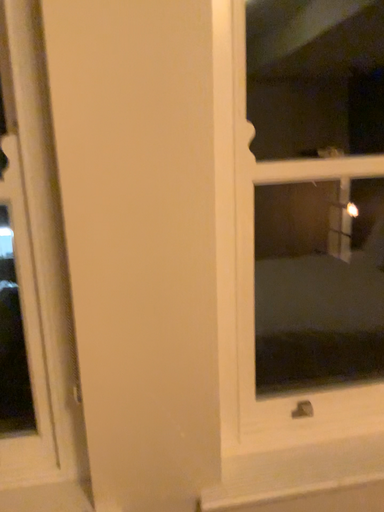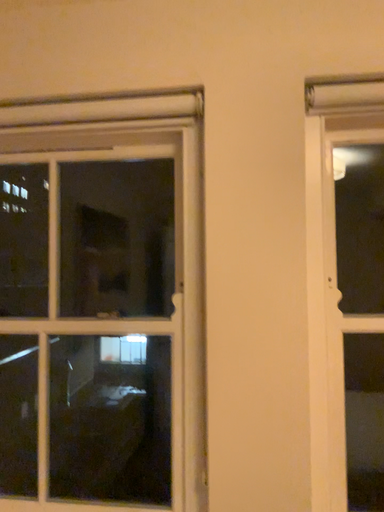
Question: How did the camera likely rotate when shooting the video?

Choices:
 (A) rotated right
 (B) rotated left

Answer: (B)